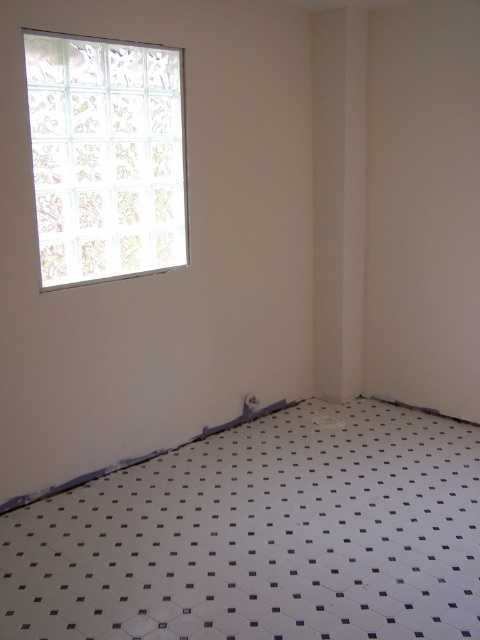
Question: Which object is closer to the camera taking this photo?

Choices:
 (A) white glossy tile at lower center
 (B) frosted glass window at upper left

Answer: (A)

Question: Can you confirm if white glossy tile at lower center is positioned above frosted glass window at upper left?

Choices:
 (A) no
 (B) yes

Answer: (A)

Question: Is white glossy tile at lower center above frosted glass window at upper left?

Choices:
 (A) yes
 (B) no

Answer: (B)

Question: Which of the following is the closest to the observer?

Choices:
 (A) frosted glass window at upper left
 (B) white glossy tile at lower center

Answer: (B)

Question: Does white glossy tile at lower center have a greater width compared to frosted glass window at upper left?

Choices:
 (A) no
 (B) yes

Answer: (B)